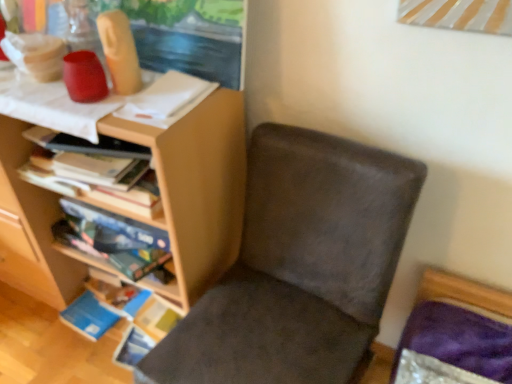
Question: Considering the relative positions of matte wood shelf at upper left, which is counted as the second shelf, starting from the bottom, and suede-like brown chair at center in the image provided, is matte wood shelf at upper left, which is counted as the second shelf, starting from the bottom, to the left or to the right of suede-like brown chair at center?

Choices:
 (A) left
 (B) right

Answer: (A)

Question: Do you think matte wood shelf at upper left, which is counted as the second shelf, starting from the bottom, is within suede-like brown chair at center, or outside of it?

Choices:
 (A) inside
 (B) outside

Answer: (B)

Question: Which object is the farthest from the suede-like brown chair at center?

Choices:
 (A) matte wood shelf at upper left, which ranks as the first shelf in top-to-bottom order
 (B) wooden bookshelf at left, which ranks as the 2th shelf in top-to-bottom order

Answer: (B)

Question: Estimate the real-world distances between objects in this image. Which object is closer to the matte wood shelf at upper left, which is counted as the second shelf, starting from the bottom?

Choices:
 (A) wooden bookshelf at left, the first shelf from the bottom
 (B) suede-like brown chair at center

Answer: (A)